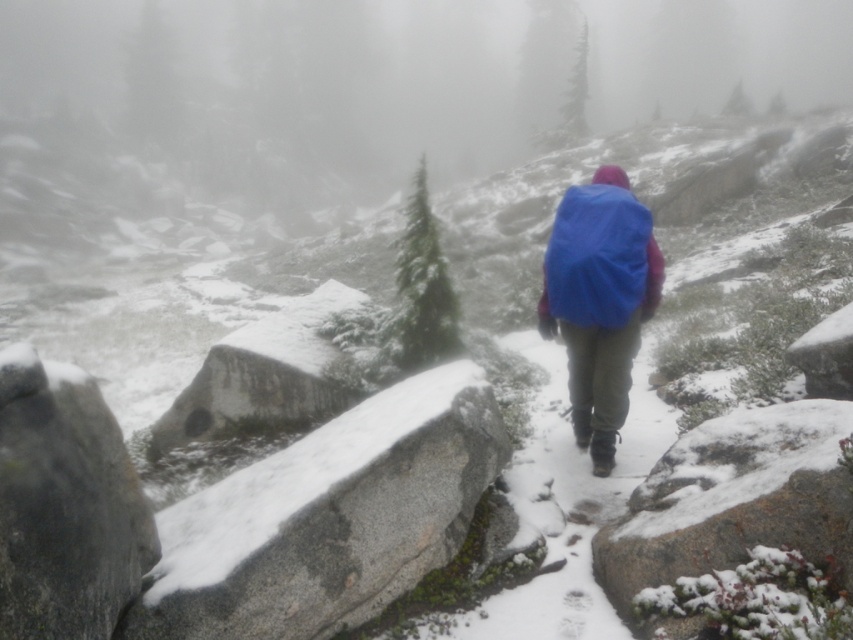
Question: Does blue matte jacket at center appear on the left side of green textured pine at center?

Choices:
 (A) no
 (B) yes

Answer: (A)

Question: Is gray granite boulder at lower left positioned before granite boulder at lower center?

Choices:
 (A) yes
 (B) no

Answer: (A)

Question: Can you confirm if granite boulder at lower center is positioned to the left of blue matte jacket at center?

Choices:
 (A) yes
 (B) no

Answer: (B)

Question: Among these objects, which one is nearest to the camera?

Choices:
 (A) gray granite boulder at lower left
 (B) green textured pine at center

Answer: (A)

Question: Which point is farther to the camera?

Choices:
 (A) (155, 568)
 (B) (3, 500)
 (C) (621, 282)

Answer: (C)

Question: Which object appears farthest from the camera in this image?

Choices:
 (A) blue fabric backpack at center
 (B) blue matte jacket at center
 (C) green textured pine at center
 (D) granite boulder at lower left

Answer: (C)